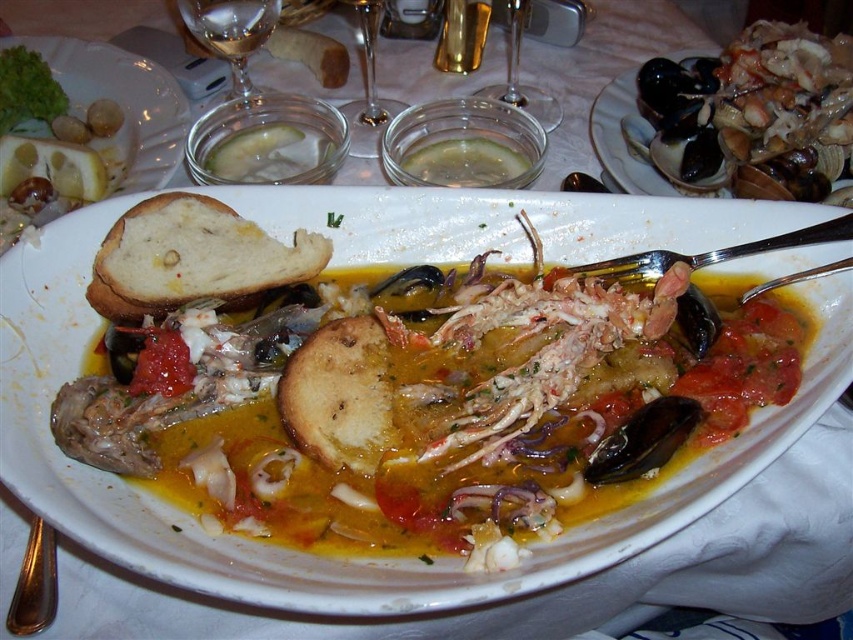
Based on the photo, who is lower down, clear glass wine at upper center or transparent glass at upper center?

clear glass wine at upper center is lower down.

Measure the distance from clear glass wine at upper center to transparent glass at upper center.

clear glass wine at upper center and transparent glass at upper center are 9.68 inches apart.

You are a GUI agent. You are given a task and a screenshot of the screen. Output one action in this format:
    pyautogui.click(x=<x>, y=<y>)
    Task: Click on the clear glass wine at upper center
    The width and height of the screenshot is (853, 640).
    Given the screenshot: What is the action you would take?
    pyautogui.click(x=229, y=24)

Locate an element on the screen. clear glass wine at upper center is located at coordinates (229, 24).

Which is above, white soft bread at center or clear glass bowl at upper center?

Positioned higher is clear glass bowl at upper center.

Does white soft bread at center appear over clear glass bowl at upper center?

Actually, white soft bread at center is below clear glass bowl at upper center.

Which is behind, point (297, 280) or point (335, 125)?

Positioned behind is point (335, 125).

Where is `white soft bread at center`? This screenshot has height=640, width=853. white soft bread at center is located at coordinates (193, 257).

Is the position of clear glass bowl at upper center more distant than that of clear glass wine glass at upper center?

No, clear glass bowl at upper center is in front of clear glass wine glass at upper center.

Does clear glass bowl at upper center appear on the left side of clear glass wine glass at upper center?

In fact, clear glass bowl at upper center is to the right of clear glass wine glass at upper center.

This screenshot has width=853, height=640. What are the coordinates of `clear glass bowl at upper center` in the screenshot? It's located at (267, 141).

The height and width of the screenshot is (640, 853). I want to click on clear glass bowl at upper center, so click(267, 141).